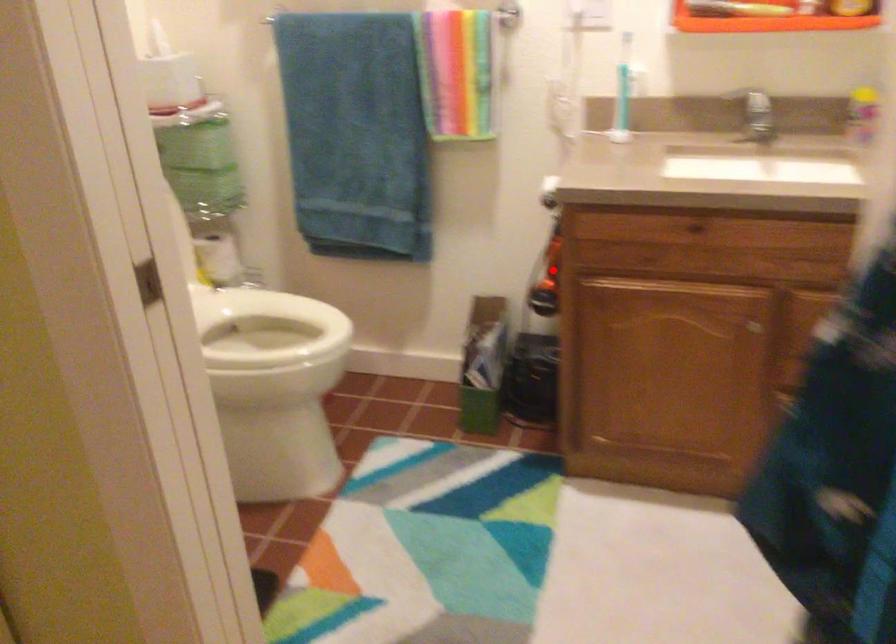
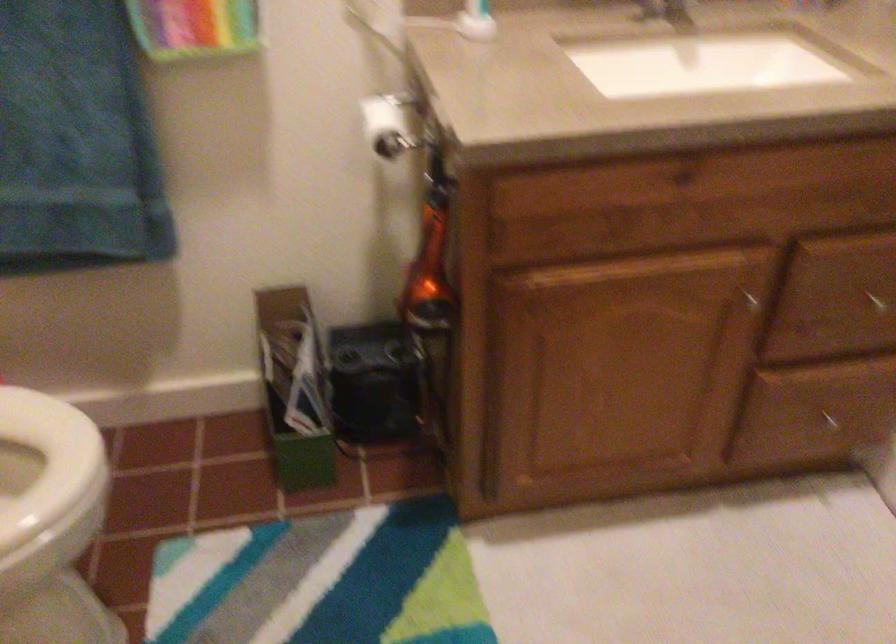
Find the pixel in the second image that matches the highlighted location in the first image.

(429, 267)